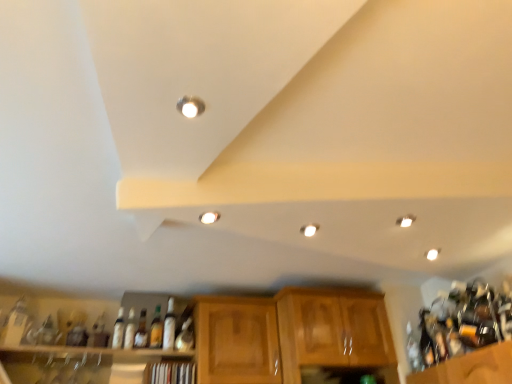
Question: Is clear glass bottle at right, which appears as the eighth bottle when viewed from the left, shorter than wooden shelf at lower center, marked as the 1th shelf in a right-to-left arrangement?

Choices:
 (A) yes
 (B) no

Answer: (B)

Question: Is clear glass bottle at right, which appears as the eighth bottle when viewed from the left, at the left side of wooden shelf at lower center, the second shelf in the left-to-right sequence?

Choices:
 (A) no
 (B) yes

Answer: (A)

Question: From a real-world perspective, is clear glass bottle at right, the first bottle positioned from the right, beneath wooden shelf at lower center, marked as the 1th shelf in a right-to-left arrangement?

Choices:
 (A) no
 (B) yes

Answer: (A)

Question: Does clear glass bottle at right, the first bottle positioned from the right, have a greater height compared to wooden shelf at lower center, the second shelf in the left-to-right sequence?

Choices:
 (A) yes
 (B) no

Answer: (A)

Question: From a real-world perspective, is matte silver light fixture at upper center, which is counted as the first lighting, starting from the front, positioned above or below white glossy light fixture at center, the third lighting when ordered from right to left?

Choices:
 (A) above
 (B) below

Answer: (A)

Question: Would you say matte silver light fixture at upper center, positioned as the 1th lighting in top-to-bottom order, is to the left or to the right of white glossy light fixture at center, the second lighting from the left, in the picture?

Choices:
 (A) right
 (B) left

Answer: (B)

Question: Looking at their shapes, would you say matte silver light fixture at upper center, placed as the fourth lighting when sorted from back to front, is wider or thinner than white glossy light fixture at center, placed as the 3th lighting when sorted from back to front?

Choices:
 (A) wide
 (B) thin

Answer: (A)

Question: Looking at the image, does matte silver light fixture at upper center, which is counted as the first lighting, starting from the front, seem bigger or smaller compared to white glossy light fixture at center, placed as the 3th lighting when sorted from back to front?

Choices:
 (A) big
 (B) small

Answer: (A)

Question: Is wooden at upper center, which appears as the 1th shelf when viewed from the left, inside the boundaries of translucent glass bottle at center, arranged as the third bottle when viewed from the left, or outside?

Choices:
 (A) outside
 (B) inside

Answer: (A)

Question: Is point (134, 377) closer or farther from the camera than point (114, 327)?

Choices:
 (A) closer
 (B) farther

Answer: (A)

Question: In terms of width, does wooden at upper center, the 2th shelf when ordered from right to left, look wider or thinner when compared to translucent glass bottle at center, acting as the 6th bottle starting from the right?

Choices:
 (A) wide
 (B) thin

Answer: (A)

Question: From a real-world perspective, relative to translucent glass bottle at center, acting as the 6th bottle starting from the right, is wooden at upper center, the 2th shelf when ordered from right to left, vertically above or below?

Choices:
 (A) below
 (B) above

Answer: (A)

Question: Considering the positions of point click(168, 319) and point click(413, 349), is point click(168, 319) closer or farther from the camera than point click(413, 349)?

Choices:
 (A) closer
 (B) farther

Answer: (A)

Question: Considering the relative positions of matte glass bottle at center, placed as the 3th bottle when sorted from right to left, and clear glass bottle at right, the first bottle positioned from the right, in the image provided, is matte glass bottle at center, placed as the 3th bottle when sorted from right to left, to the left or to the right of clear glass bottle at right, the first bottle positioned from the right,?

Choices:
 (A) right
 (B) left

Answer: (B)